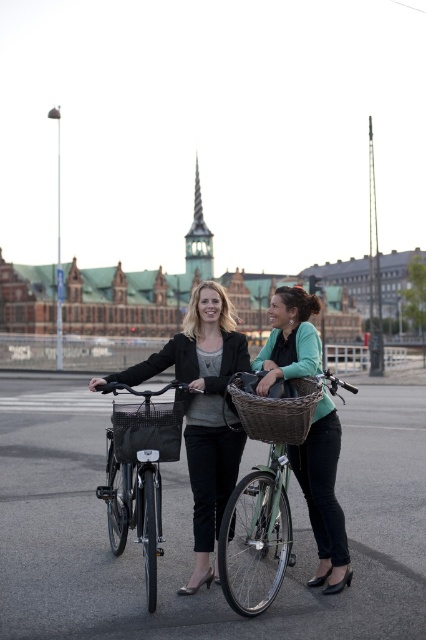
Question: Can you confirm if matte black bicycle at center is positioned to the left of black woven basket at center?

Choices:
 (A) yes
 (B) no

Answer: (A)

Question: Is matte green bicycle at center wider than woven brown basket at center?

Choices:
 (A) yes
 (B) no

Answer: (A)

Question: Is matte black bicycle at center positioned at the back of woven brown basket at center?

Choices:
 (A) yes
 (B) no

Answer: (B)

Question: Which object is closer to the camera taking this photo?

Choices:
 (A) matte black jacket at center
 (B) matte black bicycle at center
 (C) woven brown basket at center
 (D) matte green bicycle at center

Answer: (B)

Question: Which point is closer to the camera?

Choices:
 (A) woven brown basket at center
 (B) matte black jacket at center

Answer: (B)

Question: Which point is closer to the camera?

Choices:
 (A) (178, 433)
 (B) (164, 420)
 (C) (284, 406)

Answer: (C)